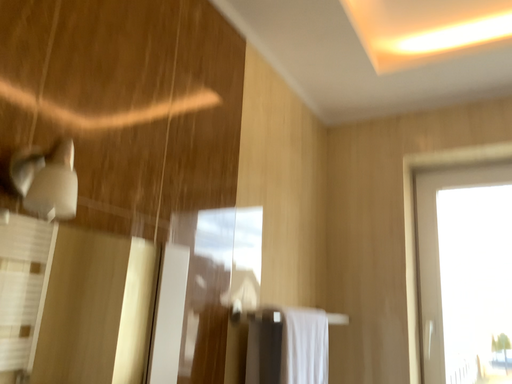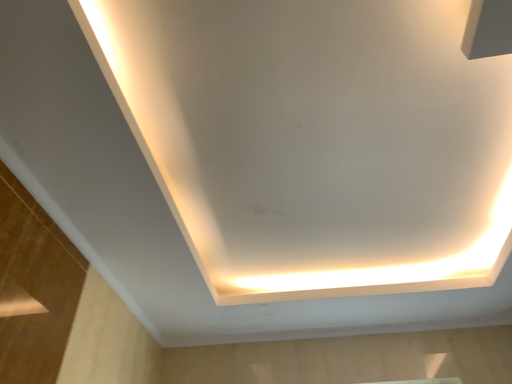
Question: How did the camera likely rotate when shooting the video?

Choices:
 (A) rotated left
 (B) rotated right

Answer: (B)